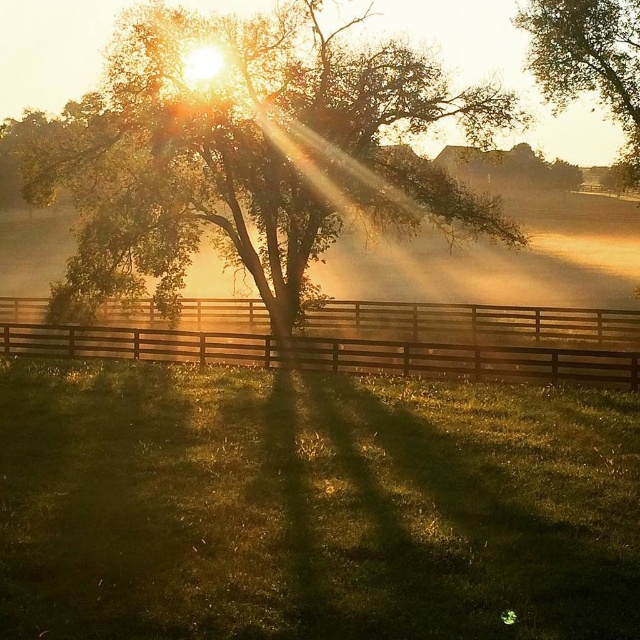
Question: Is brown wooden fence at center thinner than smooth green tree at upper right?

Choices:
 (A) no
 (B) yes

Answer: (A)

Question: Which is farther from the brown wooden fence at center?

Choices:
 (A) smooth brown tree at upper center
 (B) green leafy tree at center

Answer: (A)

Question: Which object is positioned closest to the smooth brown tree at upper center?

Choices:
 (A) smooth green tree at upper right
 (B) brown wooden fence at center

Answer: (A)

Question: Is brown wooden fence at center closer to camera compared to smooth brown tree at upper center?

Choices:
 (A) no
 (B) yes

Answer: (B)

Question: Is brown wooden fence at center above smooth brown tree at upper center?

Choices:
 (A) yes
 (B) no

Answer: (B)

Question: Which of these objects is positioned farthest from the smooth brown tree at upper center?

Choices:
 (A) brown wooden fence at center
 (B) smooth green tree at upper right

Answer: (A)